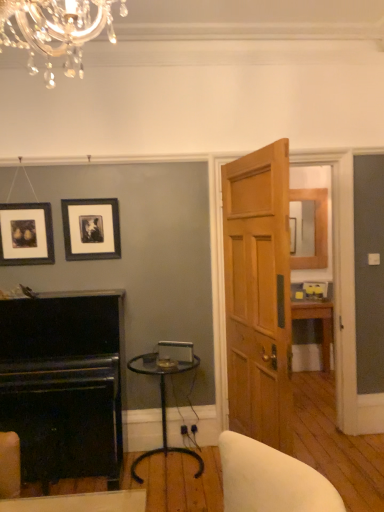
Find the location of a particular element. free space above matte black picture frame at upper left, the second picture frame positioned from the right (from a real-world perspective) is located at coordinates (23, 204).